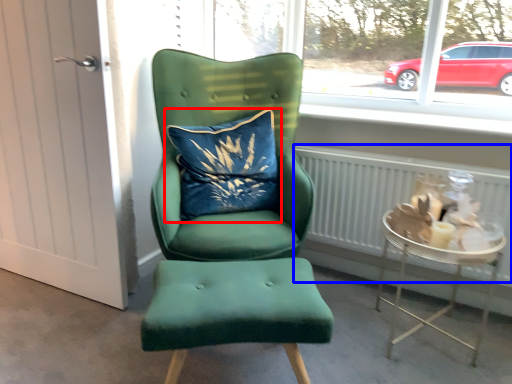
Question: Which of the following is the farthest to the observer, pillow (highlighted by a red box) or radiator (highlighted by a blue box)?

Choices:
 (A) pillow
 (B) radiator

Answer: (A)